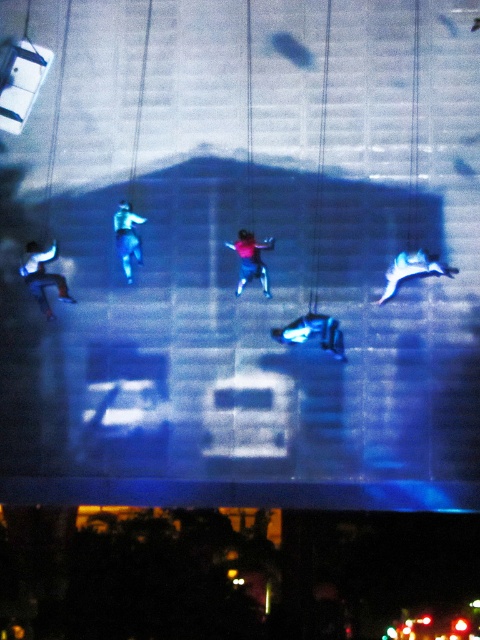
Is matte blue jeans at lower left wider than shiny metallic car at center?

No, matte blue jeans at lower left is not wider than shiny metallic car at center.

Can you confirm if matte blue jeans at lower left is shorter than shiny metallic car at center?

No, matte blue jeans at lower left is not shorter than shiny metallic car at center.

Identify the location of matte blue jeans at lower left. The image size is (480, 640). (43, 275).

Which is above, white matte bird at upper right or blue fabric pants at center?

Positioned higher is blue fabric pants at center.

Which is in front, point (422, 259) or point (252, 260)?

Positioned in front is point (422, 259).

The image size is (480, 640). What are the coordinates of `white matte bird at upper right` in the screenshot? It's located at (412, 269).

Is shiny metallic car at center behind blue fabric figure at center?

No, it is not.

Can you confirm if shiny metallic car at center is shorter than blue fabric figure at center?

Correct, shiny metallic car at center is not as tall as blue fabric figure at center.

Find the location of a particular element. shiny metallic car at center is located at coordinates coord(312,332).

At what (x,y) coordinates should I click in order to perform the action: click on shiny metallic car at center. Please return your answer as a coordinate pair (x, y). Looking at the image, I should click on (312, 332).